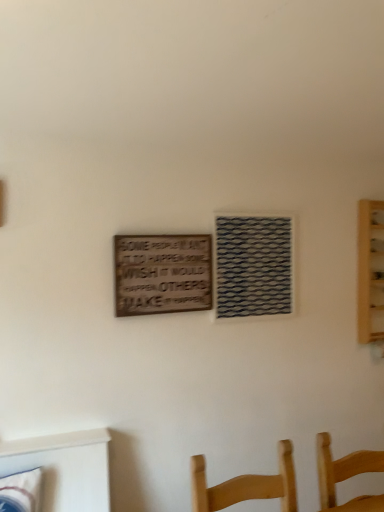
Question: Is woven fabric window at center wider or thinner than wooden sign at center?

Choices:
 (A) thin
 (B) wide

Answer: (B)

Question: Is woven fabric window at center bigger or smaller than wooden sign at center?

Choices:
 (A) big
 (B) small

Answer: (A)

Question: Relative to wooden sign at center, is woven fabric window at center in front or behind?

Choices:
 (A) behind
 (B) front

Answer: (A)

Question: From the image's perspective, is wooden sign at center located above or below woven fabric window at center?

Choices:
 (A) below
 (B) above

Answer: (A)

Question: In terms of height, does wooden sign at center look taller or shorter compared to woven fabric window at center?

Choices:
 (A) short
 (B) tall

Answer: (A)

Question: Considering the positions of point (125, 260) and point (218, 297), is point (125, 260) closer or farther from the camera than point (218, 297)?

Choices:
 (A) closer
 (B) farther

Answer: (A)

Question: Is wooden sign at center wider or thinner than woven fabric window at center?

Choices:
 (A) thin
 (B) wide

Answer: (A)